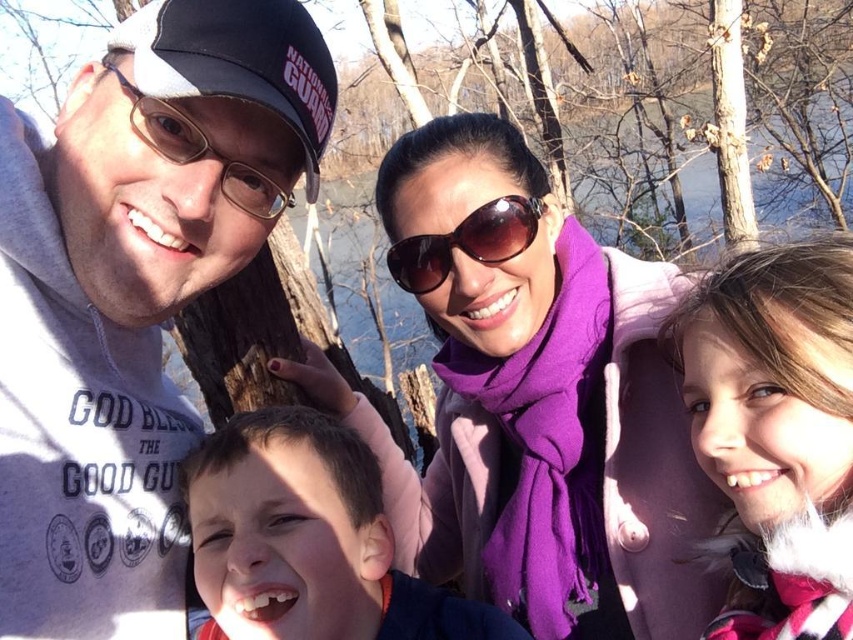
Question: Which object appears farthest from the camera in this image?

Choices:
 (A) brown reflective sunglasses at center
 (B) gray cotton hoodie at left

Answer: (A)

Question: Is brown reflective sunglasses at center positioned before matte black goggles at left?

Choices:
 (A) yes
 (B) no

Answer: (B)

Question: Which point is farther to the camera?

Choices:
 (A) (282, 202)
 (B) (457, 272)

Answer: (B)

Question: Is gray cotton hoodie at left in front of brown reflective sunglasses at center?

Choices:
 (A) yes
 (B) no

Answer: (A)

Question: Which point appears farthest from the camera in this image?

Choices:
 (A) tap(154, 150)
 (B) tap(677, 460)
 (C) tap(93, 618)

Answer: (B)

Question: Can you confirm if gray cotton hoodie at left is wider than matte black goggles at left?

Choices:
 (A) yes
 (B) no

Answer: (A)